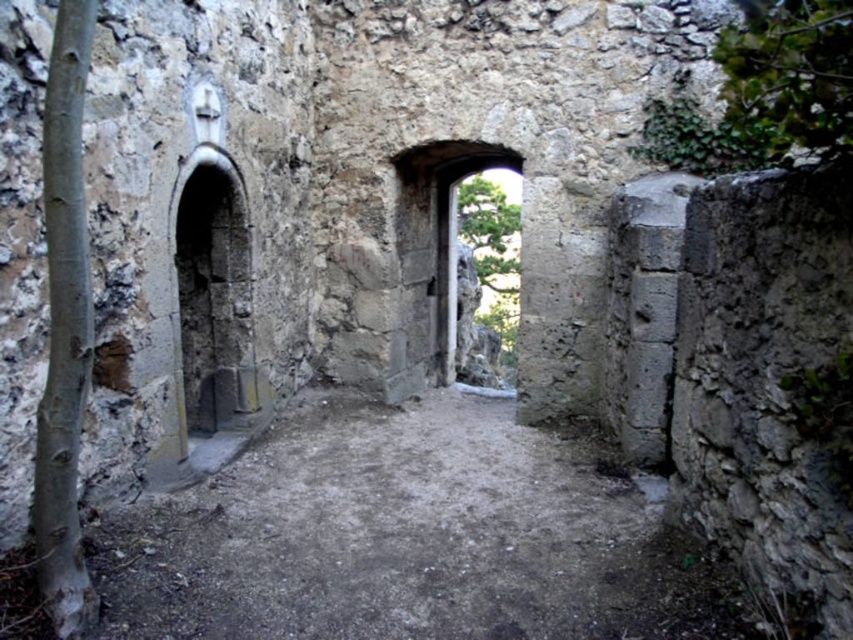
You are a historian examining the ancient stone corridor. You notice two arches in the corridor. The first is the rusty stone arch at left, and the second is the stone archway at center. Which arch is shorter in height?

The rusty stone arch at left has a lesser height compared to the stone archway at center, so the rusty stone arch at left is shorter in height.

Based on the photo, you are standing at the entrance of the corridor and see the point marked at coordinates (213,308). Based on the scene description, what object does this point most likely represent?

The point at coordinates (213,308) most likely represents the rusty stone arch at left, as it is the only object in the scene described as being located on the left side of the corridor.